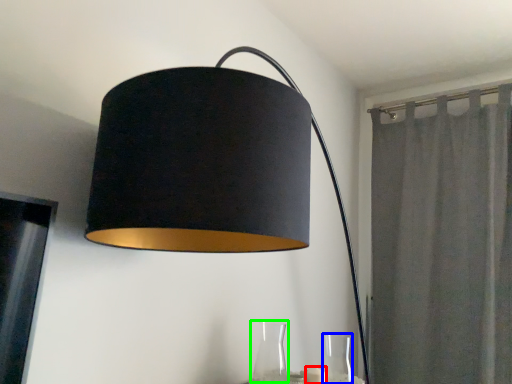
Question: Which is farther away from candle (highlighted by a red box)? glass vase (highlighted by a blue box) or glass vase (highlighted by a green box)?

Choices:
 (A) glass vase
 (B) glass vase

Answer: (B)